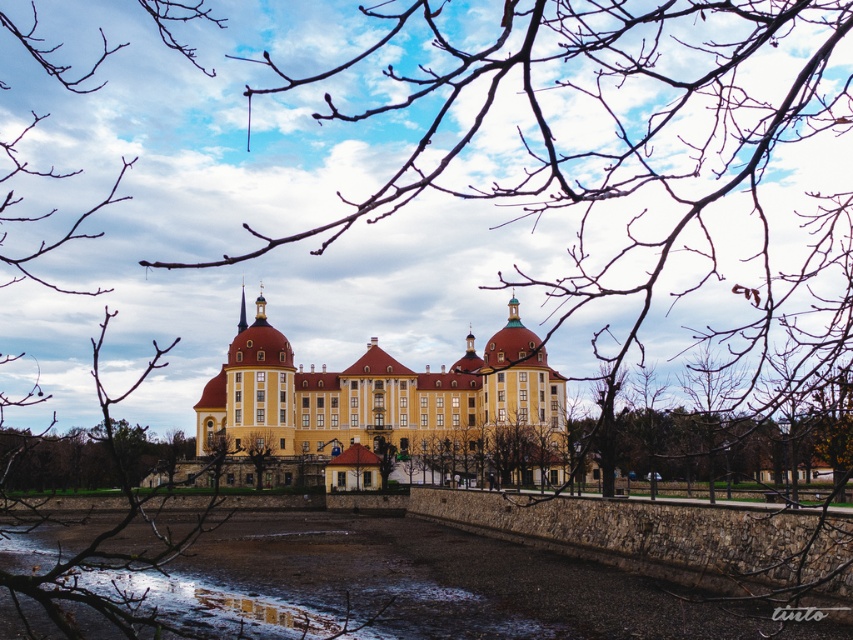
Consider the image. Can you confirm if yellow matte building at center is taller than green leafy tree at center?

Yes, yellow matte building at center is taller than green leafy tree at center.

The image size is (853, 640). What are the coordinates of `yellow matte building at center` in the screenshot? It's located at (396, 404).

Between point (538, 396) and point (242, 436), which one is positioned behind?

Positioned behind is point (538, 396).

You are a GUI agent. You are given a task and a screenshot of the screen. Output one action in this format:
    pyautogui.click(x=<x>, y=<y>)
    Task: Click on the yellow matte building at center
    
    Given the screenshot: What is the action you would take?
    pyautogui.click(x=396, y=404)

Is yellow matte building at center further to the viewer compared to glossy concrete puddle at lower center?

That is True.

Between yellow matte building at center and glossy concrete puddle at lower center, which one appears on the left side from the viewer's perspective?

glossy concrete puddle at lower center is more to the left.

Where is `yellow matte building at center`? yellow matte building at center is located at coordinates 396,404.

Is glossy concrete puddle at lower center to the right of green leafy tree at center from the viewer's perspective?

Yes, glossy concrete puddle at lower center is to the right of green leafy tree at center.

Which of these two, glossy concrete puddle at lower center or green leafy tree at center, stands taller?

Standing taller between the two is green leafy tree at center.

Is point (221, 600) closer to camera compared to point (262, 449)?

Yes, it is in front of point (262, 449).

You are a GUI agent. You are given a task and a screenshot of the screen. Output one action in this format:
    pyautogui.click(x=<x>, y=<y>)
    Task: Click on the glossy concrete puddle at lower center
    
    Given the screenshot: What is the action you would take?
    pyautogui.click(x=267, y=611)